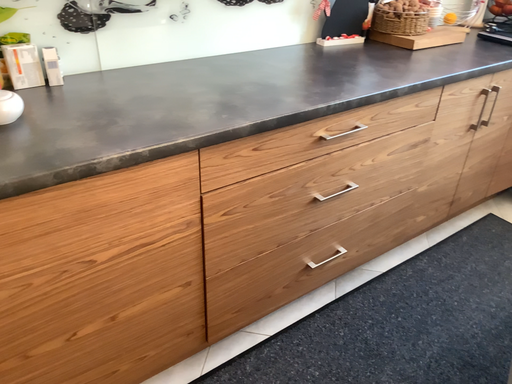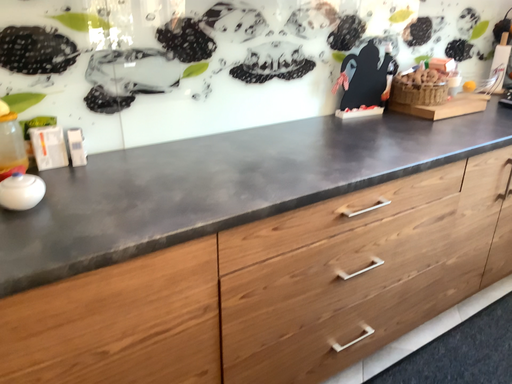
Question: How did the camera likely rotate when shooting the video?

Choices:
 (A) rotated downward
 (B) rotated upward

Answer: (B)